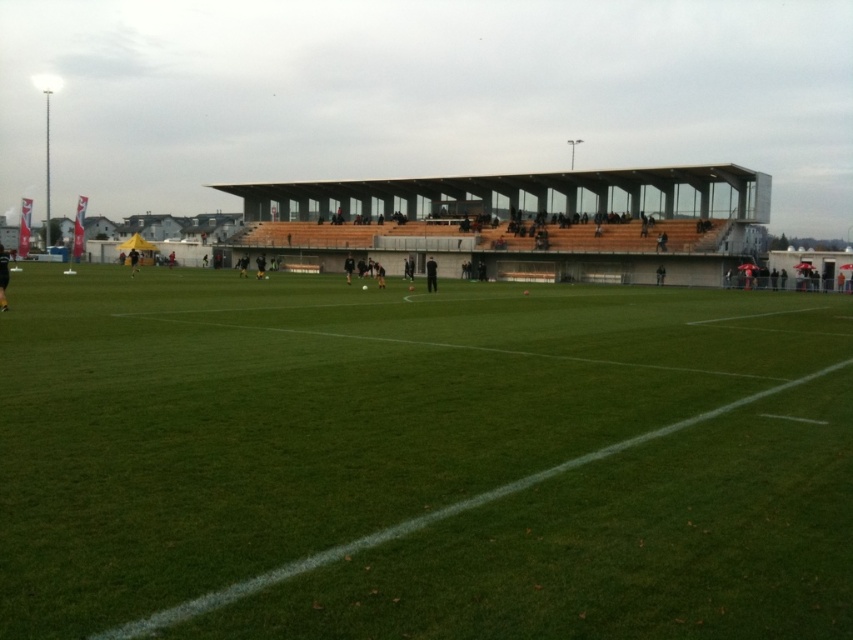
You are a soccer player standing at the edge of the green grass field at center. You want to walk to the transparent glass stadium at upper center to get a better view. Which direction should you move towards?

You should move upwards from the green grass field at center towards the transparent glass stadium at upper center since the stadium is located above the field.

You are a photographer standing at the point labeled as point (695, 500) on the soccer field. You want to take a photo of the entire soccer field from your current position. Considering the distance between you and the camera, will the camera be able to capture the entire field in one shot?

The distance between point (695, 500) and the camera is 5.91 meters. However, without knowing the camera lens specifications or field of view, it is impossible to determine if the entire field can be captured in one shot.

You are standing at the origin point of the soccer field coordinate system. Where is the green grass field at center located in terms of coordinates?

The green grass field at center is located at coordinates point [422,458].